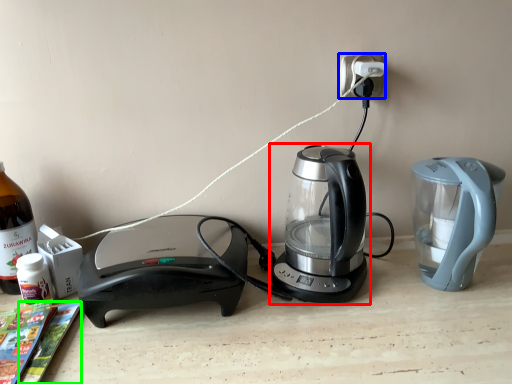
Question: Which object is positioned closest to kettle (highlighted by a red box)? Select from electric outlet (highlighted by a blue box) and magazine (highlighted by a green box).

Choices:
 (A) electric outlet
 (B) magazine

Answer: (A)